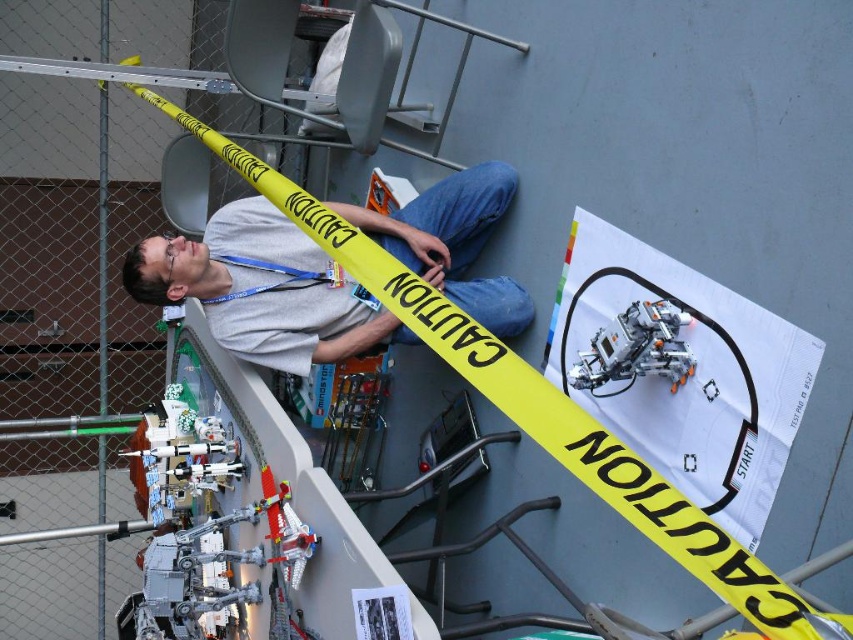
Question: Which object appears farthest from the camera in this image?

Choices:
 (A) metallic silver robot at center
 (B) gray fabric shirt at center

Answer: (B)

Question: Can you confirm if gray fabric shirt at center is positioned below metallic silver robot at center?

Choices:
 (A) yes
 (B) no

Answer: (B)

Question: Which of the following is the farthest from the observer?

Choices:
 (A) (689, 360)
 (B) (505, 285)

Answer: (B)

Question: Does gray fabric shirt at center have a larger size compared to metallic silver robot at center?

Choices:
 (A) no
 (B) yes

Answer: (B)

Question: Can you confirm if gray fabric shirt at center is smaller than metallic silver robot at center?

Choices:
 (A) no
 (B) yes

Answer: (A)

Question: Among these objects, which one is nearest to the camera?

Choices:
 (A) gray fabric shirt at center
 (B) metallic silver robot at center

Answer: (B)